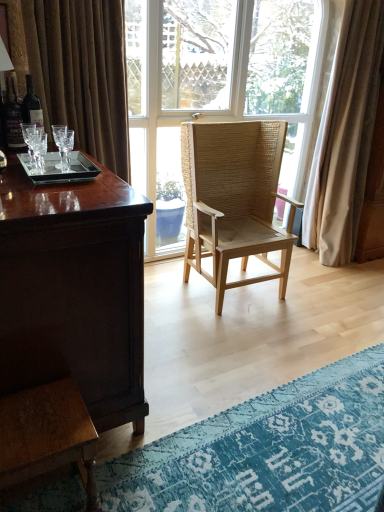
The image size is (384, 512). In order to click on vacant space situated on the left part of natural woven wood chair at center in this screenshot , I will do `click(165, 286)`.